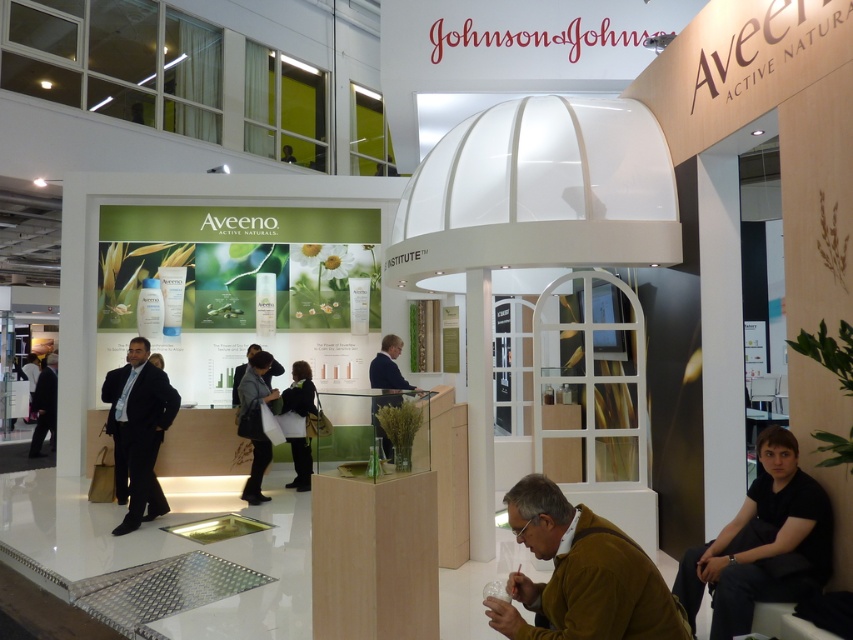
Can you confirm if dark gray fabric jacket at center is shorter than dark suit at left?

No.

Does point (239, 424) come closer to viewer compared to point (35, 426)?

Yes.

The height and width of the screenshot is (640, 853). Identify the location of dark gray fabric jacket at center. (254, 387).

Where is `dark gray fabric jacket at center`? dark gray fabric jacket at center is located at coordinates pyautogui.click(x=254, y=387).

In the scene shown: Who is higher up, dark suit at center or dark blue fabric at center?

dark blue fabric at center is higher up.

Measure the distance between point (144, 490) and camera.

Point (144, 490) and camera are 5.94 meters apart.

At what (x,y) coordinates should I click in order to perform the action: click on dark suit at center. Please return your answer as a coordinate pair (x, y). Looking at the image, I should click on (141, 432).

Is dark blue fabric at center closer to camera compared to dark suit at left?

Yes, dark blue fabric at center is closer to the viewer.

This screenshot has height=640, width=853. What are the coordinates of `dark blue fabric at center` in the screenshot? It's located at (386, 384).

The width and height of the screenshot is (853, 640). Identify the location of dark blue fabric at center. (386, 384).